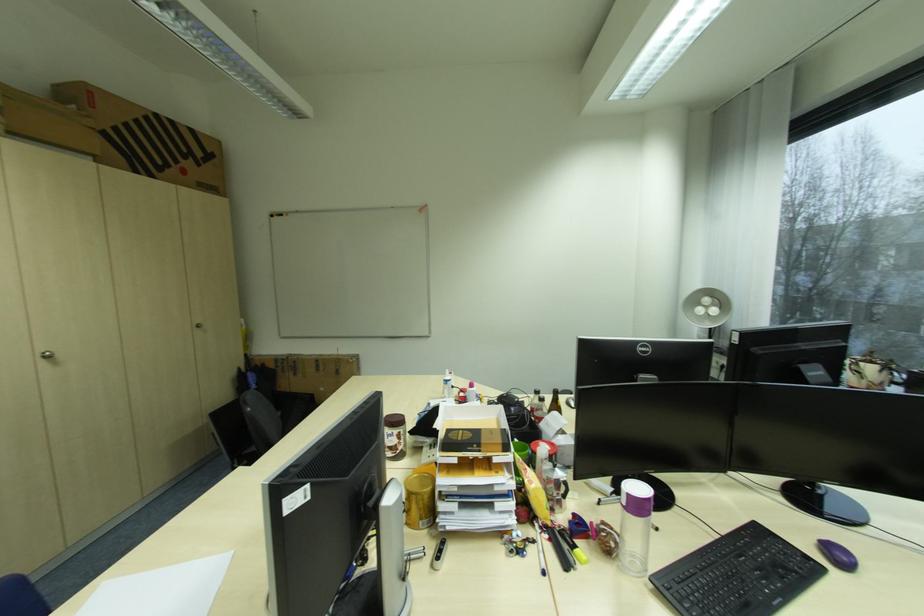
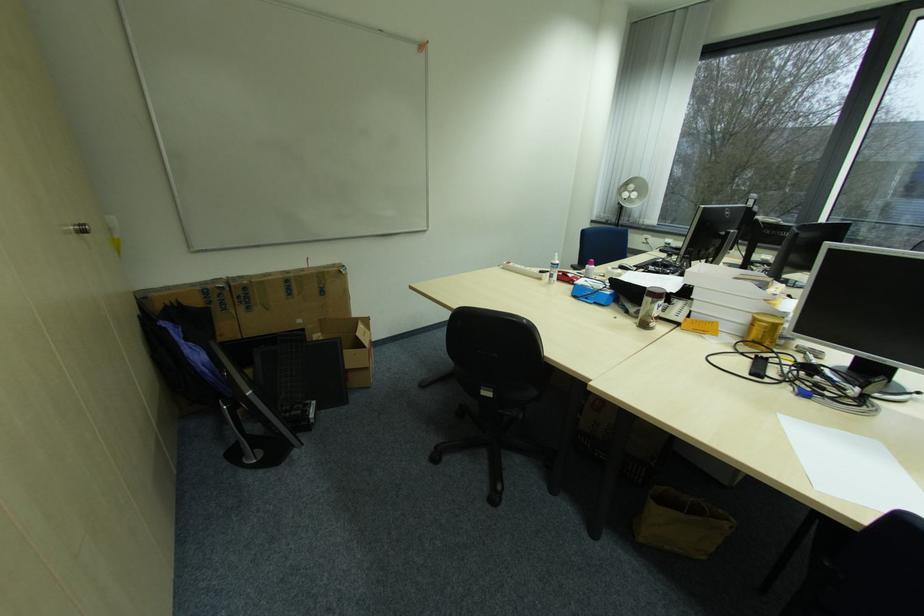
Locate, in the second image, the point that corresponds to [304,374] in the first image.

(257, 309)